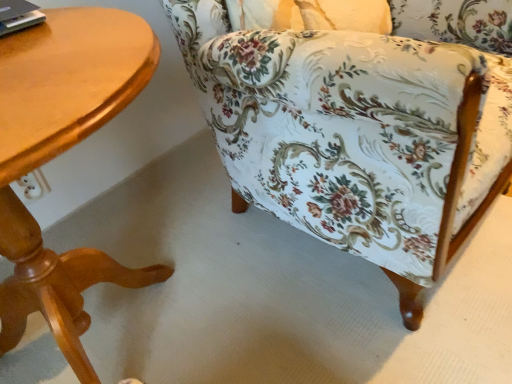
Question: From the image's perspective, is floral fabric chair at center located above or below wooden table at left?

Choices:
 (A) above
 (B) below

Answer: (A)

Question: Based on their sizes in the image, would you say floral fabric chair at center is bigger or smaller than wooden table at left?

Choices:
 (A) big
 (B) small

Answer: (A)

Question: Relative to wooden table at left, is floral fabric chair at center in front or behind?

Choices:
 (A) front
 (B) behind

Answer: (B)

Question: Is point tap(53, 157) positioned closer to the camera than point tap(445, 129)?

Choices:
 (A) farther
 (B) closer

Answer: (A)

Question: From a real-world perspective, relative to floral fabric chair at center, is wooden table at left vertically above or below?

Choices:
 (A) below
 (B) above

Answer: (A)

Question: Looking at the image, does wooden table at left seem bigger or smaller compared to floral fabric chair at center?

Choices:
 (A) small
 (B) big

Answer: (A)

Question: Is wooden table at left to the left or to the right of floral fabric chair at center in the image?

Choices:
 (A) left
 (B) right

Answer: (A)